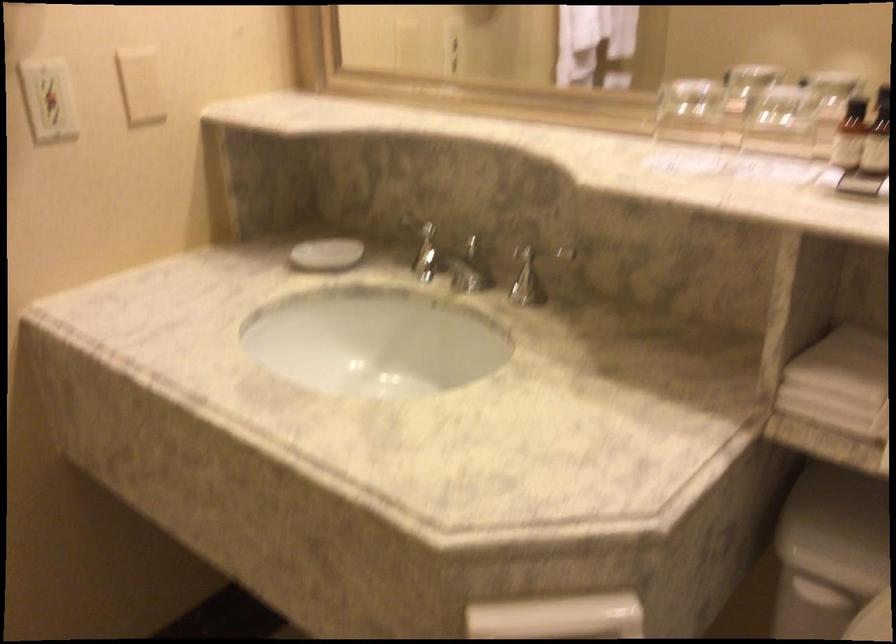
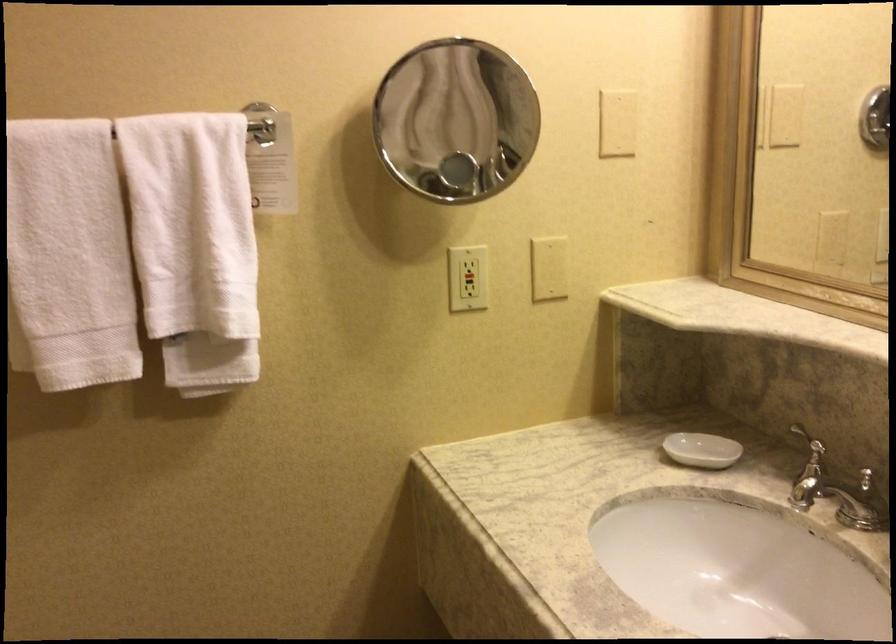
Question: The camera is either moving clockwise (left) or counter-clockwise (right) around the object. The first image is from the beginning of the video and the second image is from the end. Is the camera moving left or right when shooting the video?

Choices:
 (A) Left
 (B) Right

Answer: (B)